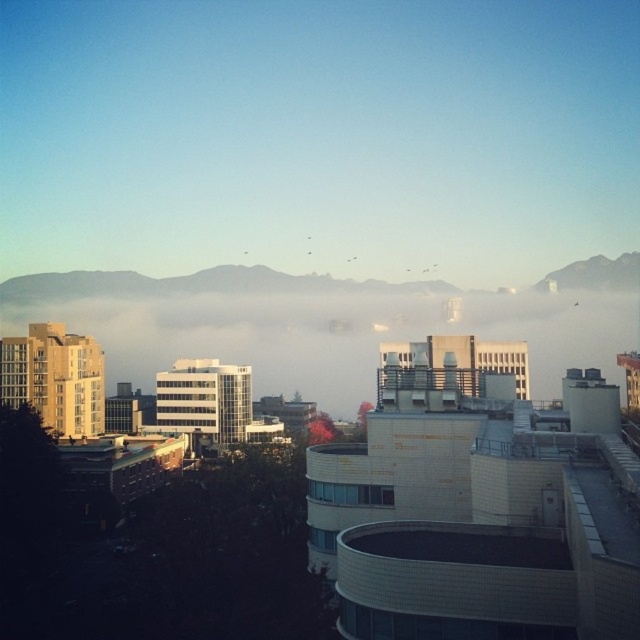
Question: Among these objects, which one is nearest to the camera?

Choices:
 (A) white fluffy morning fog at center
 (B) rocky gray mountain at upper right

Answer: (A)

Question: Observing the image, what is the correct spatial positioning of white fluffy morning fog at center in reference to rocky gray mountain at upper right?

Choices:
 (A) left
 (B) right

Answer: (A)

Question: Among these points, which one is nearest to the camera?

Choices:
 (A) (536, 284)
 (B) (147, 298)

Answer: (B)

Question: Where is white fluffy morning fog at center located in relation to rocky gray mountain at upper right in the image?

Choices:
 (A) below
 (B) above

Answer: (A)

Question: Among these points, which one is farthest from the camera?

Choices:
 (A) pyautogui.click(x=256, y=355)
 (B) pyautogui.click(x=604, y=266)

Answer: (B)

Question: Is white fluffy morning fog at center bigger than rocky gray mountain at upper right?

Choices:
 (A) no
 (B) yes

Answer: (B)